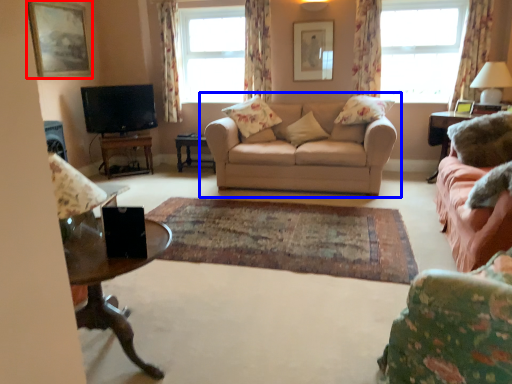
Question: Which object is further to the camera taking this photo, picture frame (highlighted by a red box) or studio couch (highlighted by a blue box)?

Choices:
 (A) picture frame
 (B) studio couch

Answer: (A)